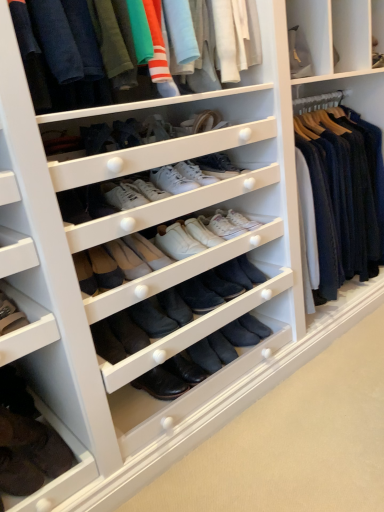
Question: Relative to white leather sneakers at center, which ranks as the second shoe in top-to-bottom order, is matte cotton t-shirts at upper center in front or behind?

Choices:
 (A) front
 (B) behind

Answer: (A)

Question: Would you say matte cotton t-shirts at upper center is to the left or to the right of white leather sneakers at center, which ranks as the 4th shoe in bottom-to-top order, in the picture?

Choices:
 (A) left
 (B) right

Answer: (A)

Question: Estimate the real-world distances between objects in this image. Which object is closer to the leather boot at lower left, the 1th footwear when ordered from top to bottom?

Choices:
 (A) matte black boots at center
 (B) brown leather boots at lower left, the second footwear when ordered from top to bottom
 (C) matte cotton t-shirts at upper center
 (D) white leather sneakers at center, the fifth shoe when ordered from bottom to top
 (E) white leather sneakers at center, which ranks as the 4th shoe in bottom-to-top order

Answer: (B)

Question: Which object is positioned farthest from the matte black boots at center?

Choices:
 (A) white leather sneakers at center, which is the first shoe in top-to-bottom order
 (B) black suede boot at center, the second shoe from the bottom
 (C) black leather boot at center, which appears as the 1th shoe when ordered from the bottom
 (D) white leather sneakers at center, the 3th shoe viewed from the top
 (E) white leather sneakers at center, which ranks as the second shoe in top-to-bottom order

Answer: (A)